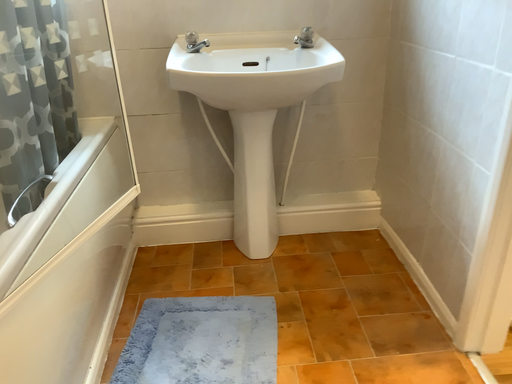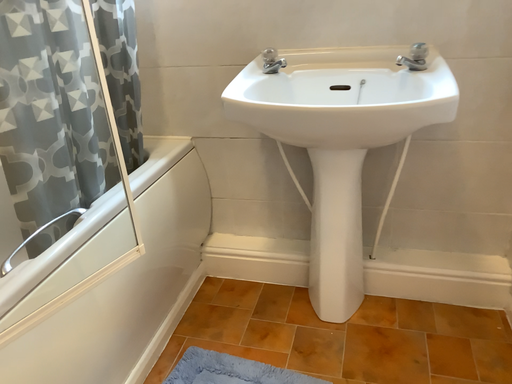
Question: Which way did the camera rotate in the video?

Choices:
 (A) rotated right
 (B) rotated left

Answer: (B)